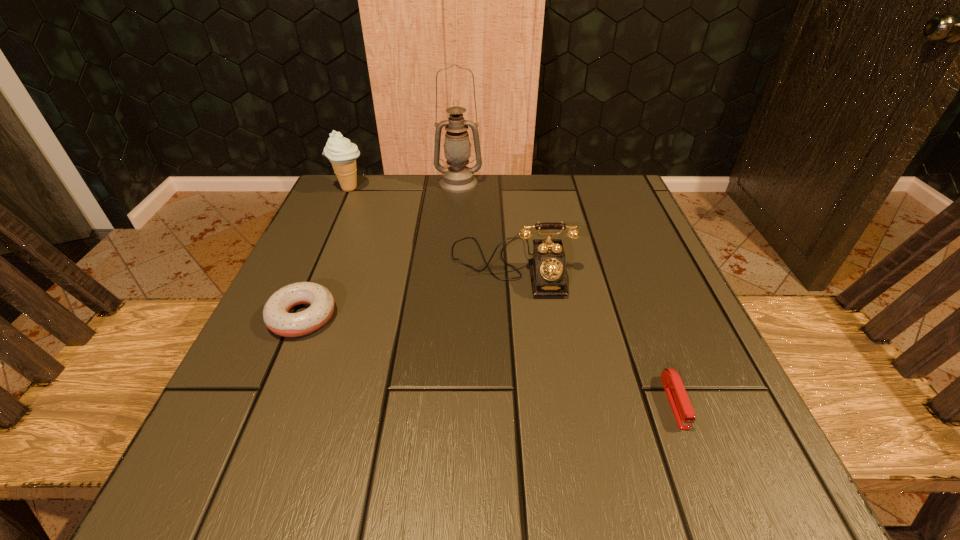
You are a GUI agent. You are given a task and a screenshot of the screen. Output one action in this format:
    pyautogui.click(x=<x>, y=<y>)
    Task: Click on the oil lamp
    This screenshot has width=960, height=540.
    Given the screenshot: What is the action you would take?
    pyautogui.click(x=458, y=178)

The image size is (960, 540). Identify the location of the fourth shortest object. (342, 154).

Locate an element on the screen. telephone is located at coordinates point(547,267).

Find the location of a particular element. The image size is (960, 540). the fourth tallest object is located at coordinates (275, 313).

Find the location of a particular element. the nearest object is located at coordinates (680, 404).

Locate an element on the screen. This screenshot has width=960, height=540. the shortest object is located at coordinates (680, 404).

This screenshot has width=960, height=540. Find the location of `vacant space positioned 0.280m on the front of the oil lamp`. vacant space positioned 0.280m on the front of the oil lamp is located at coordinates (452, 267).

At what (x,y) coordinates should I click in order to perform the action: click on free point located 0.320m on the right of the icecream. Please return your answer as a coordinate pair (x, y). The width and height of the screenshot is (960, 540). Looking at the image, I should click on (495, 188).

The width and height of the screenshot is (960, 540). What are the coordinates of `vacant position located 0.200m on the dial of the telephone` in the screenshot? It's located at (522, 394).

In order to click on free region located on the front of the second shortest object in this screenshot , I will do `click(275, 383)`.